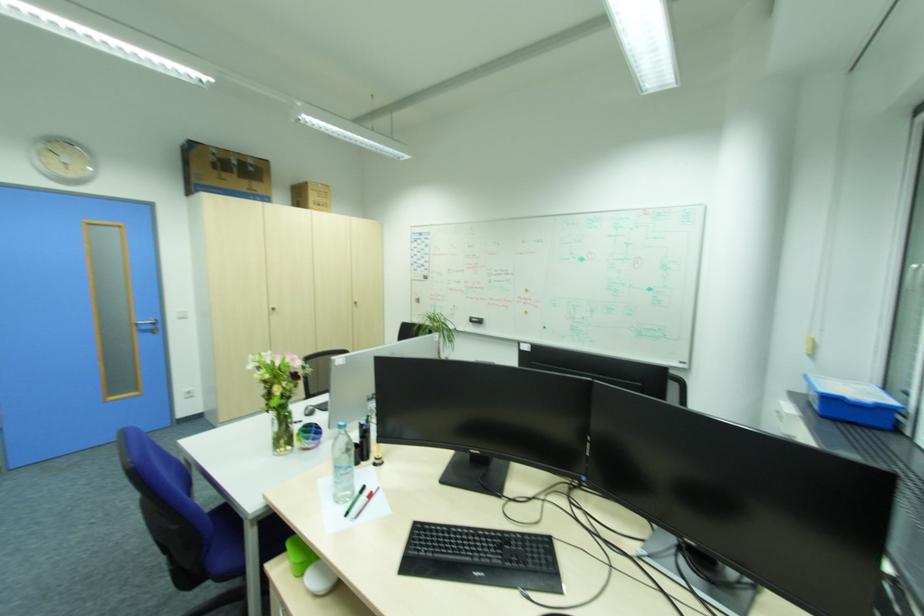
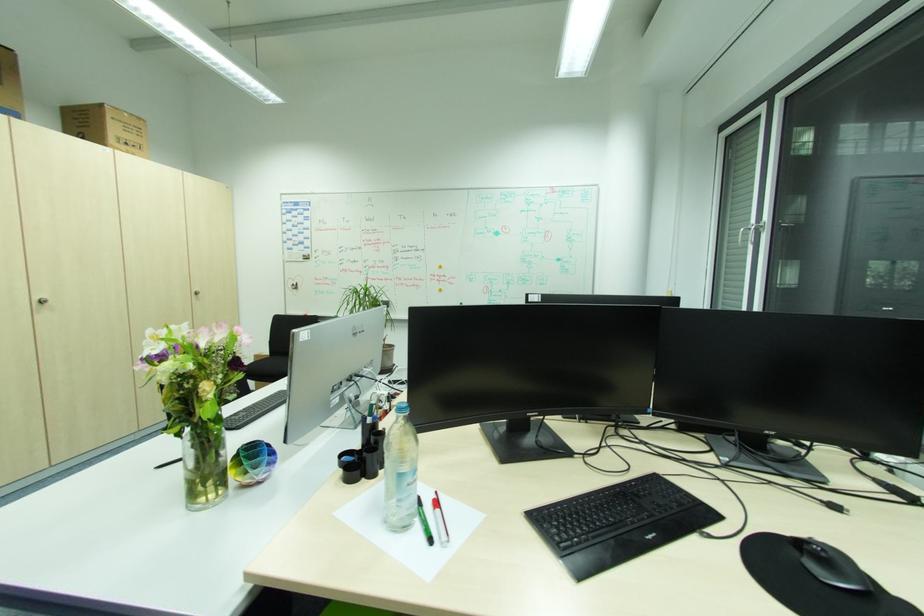
Locate, in the second image, the point that corresponds to pixel 360 302 in the first image.

(202, 293)